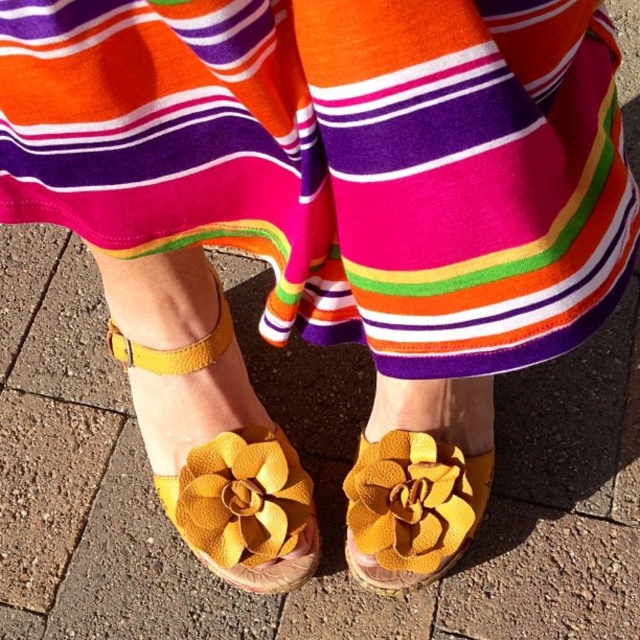
You are examining the person in the image and notice two points on their legs. The first point is at coordinates point [221,445] and the second is at point [211,464]. Which point is closer to you?

Point [221,445] is closer to the viewer than point [211,464].